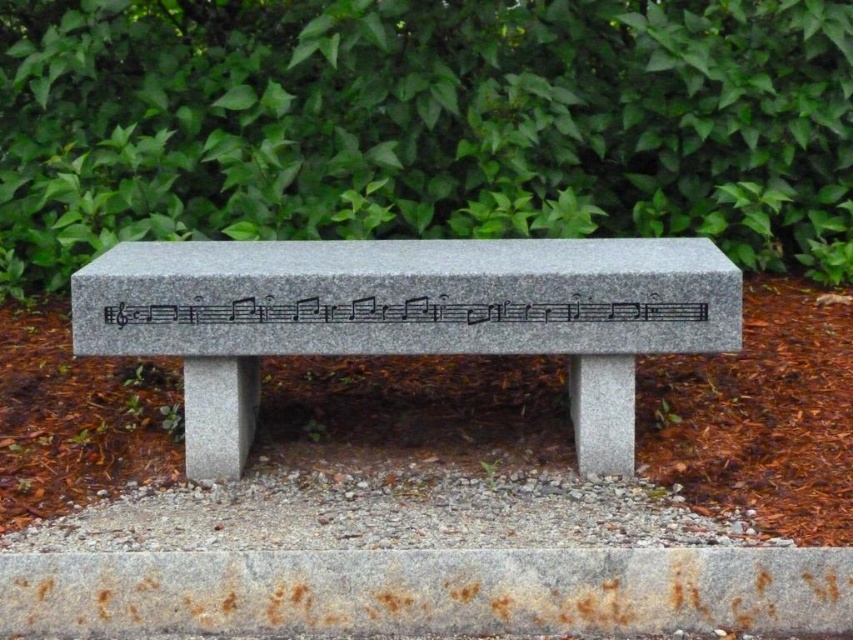
Which is more to the right, granite bench at center or black granite musical notes at center?

Positioned to the right is granite bench at center.

Can you confirm if granite bench at center is positioned to the left of black granite musical notes at center?

No, granite bench at center is not to the left of black granite musical notes at center.

Does point (676, 326) lie behind point (456, 301)?

Yes.

The image size is (853, 640). I want to click on granite bench at center, so click(405, 317).

Between green leafy bush at upper center and black granite musical notes at center, which one has less height?

black granite musical notes at center

Which is in front, point (503, 109) or point (477, 310)?

Point (477, 310) is in front.

In order to click on green leafy bush at upper center in this screenshot , I will do tap(424, 124).

Locate an element on the screen. green leafy bush at upper center is located at coordinates (424, 124).

Between green leafy bush at upper center and granite bench at center, which one is positioned lower?

Positioned lower is granite bench at center.

Is point (570, 12) closer to camera compared to point (218, 298)?

No, (570, 12) is behind (218, 298).

What do you see at coordinates (424, 124) in the screenshot? I see `green leafy bush at upper center` at bounding box center [424, 124].

Identify the location of green leafy bush at upper center. This screenshot has height=640, width=853. (424, 124).